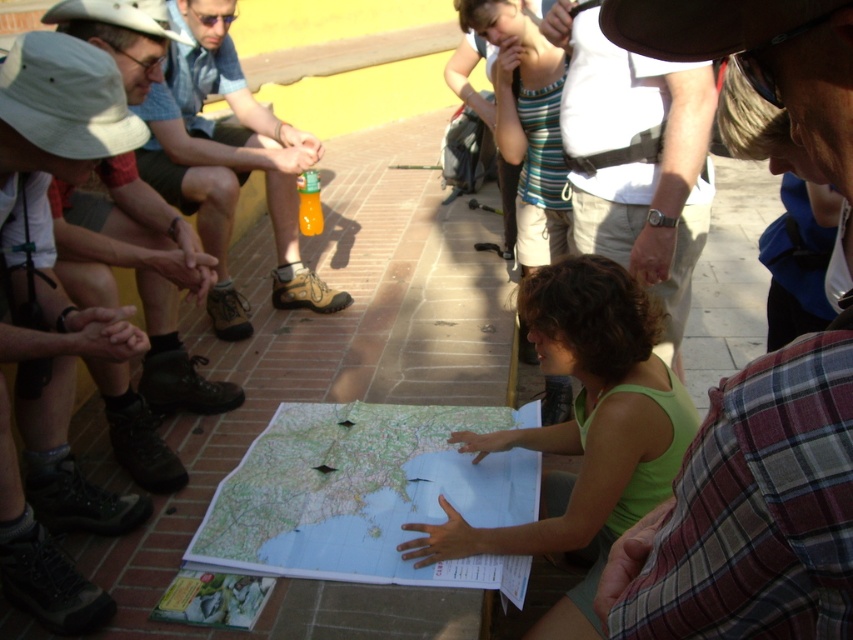
You are a participant in the meeting around the map. You need to locate the point with coordinates (369, 496). Where on the map should you look?

The point with coordinates (369, 496) is located on the white paper map at center, so you should look at the central area of the map.

Based on the scene description, can you determine if the white paper map at center is wider than the white cotton shirt at upper center?

The white paper map at center might be wider than white cotton shirt at upper center according to the description.

You are standing at the position of point (x=711, y=188) and want to walk towards point (x=354, y=451). Based on the scene description, will you be moving towards the map or away from it?

Point (x=354, y=451) is behind point (x=711, y=188), so moving from point (x=711, y=188) towards point (x=354, y=451) would mean moving away from the map.